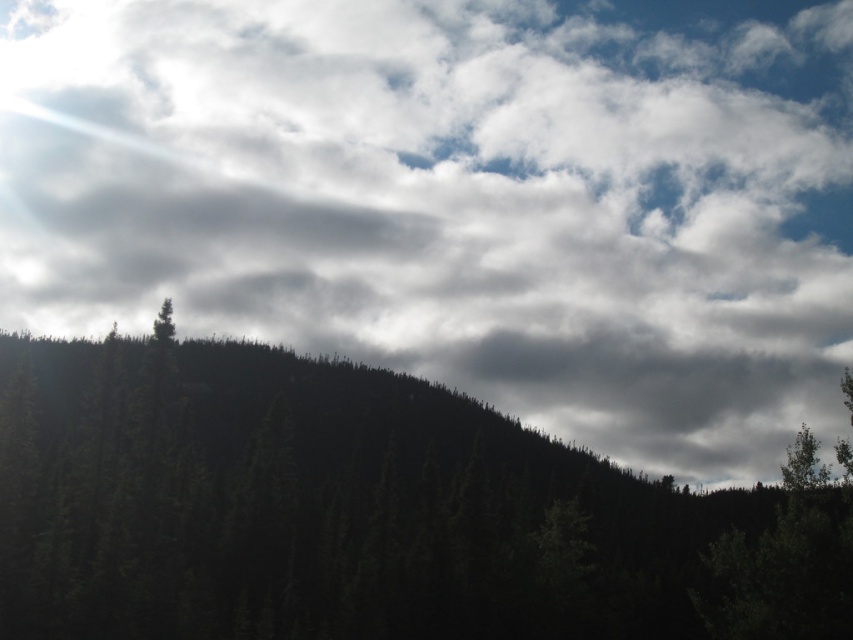
Can you confirm if dark green textured trees at center is positioned to the right of green matte tree at lower right?

In fact, dark green textured trees at center is to the left of green matte tree at lower right.

Does dark green textured trees at center have a greater width compared to green matte tree at lower right?

Correct, the width of dark green textured trees at center exceeds that of green matte tree at lower right.

The width and height of the screenshot is (853, 640). What do you see at coordinates (363, 513) in the screenshot?
I see `dark green textured trees at center` at bounding box center [363, 513].

Locate an element on the screen. Image resolution: width=853 pixels, height=640 pixels. dark green textured trees at center is located at coordinates (363, 513).

Is dark green textured trees at center thinner than green matte tree at upper left?

Incorrect, dark green textured trees at center's width is not less than green matte tree at upper left's.

Is point (541, 508) farther from camera compared to point (161, 326)?

That is True.

Is point (231, 538) positioned behind point (167, 314)?

Yes, it is.

Identify the location of dark green textured trees at center. (363, 513).

Which is below, green matte tree at lower right or green matte tree at upper left?

Positioned lower is green matte tree at lower right.

Can you confirm if green matte tree at lower right is positioned below green matte tree at upper left?

Correct, green matte tree at lower right is located below green matte tree at upper left.

Which is behind, point (795, 484) or point (169, 337)?

Point (169, 337)

The height and width of the screenshot is (640, 853). Identify the location of green matte tree at lower right. (804, 464).